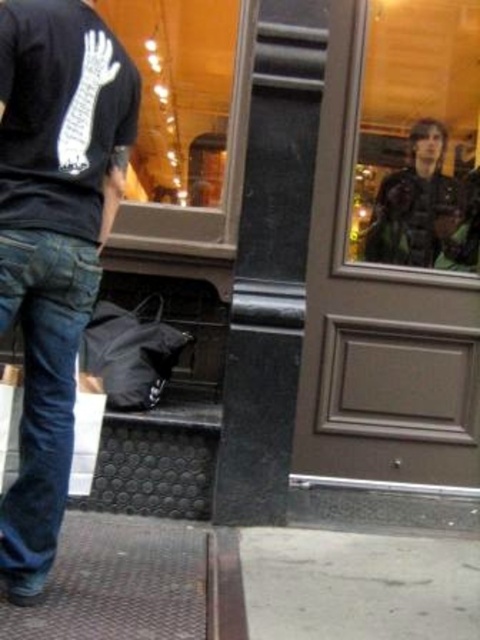
Can you confirm if transparent glass door at upper right is positioned to the right of denim at left?

Indeed, transparent glass door at upper right is positioned on the right side of denim at left.

Can you confirm if transparent glass door at upper right is taller than denim at left?

Indeed, transparent glass door at upper right has a greater height compared to denim at left.

The width and height of the screenshot is (480, 640). What do you see at coordinates (419, 138) in the screenshot? I see `transparent glass door at upper right` at bounding box center [419, 138].

This screenshot has width=480, height=640. I want to click on transparent glass door at upper right, so click(x=419, y=138).

Where is `gray concrete pavement at lower center`? gray concrete pavement at lower center is located at coordinates (359, 586).

What do you see at coordinates (359, 586) in the screenshot?
I see `gray concrete pavement at lower center` at bounding box center [359, 586].

At what (x,y) coordinates should I click in order to perform the action: click on gray concrete pavement at lower center. Please return your answer as a coordinate pair (x, y). The image size is (480, 640). Looking at the image, I should click on (359, 586).

Is point (130, 148) positioned behind point (392, 193)?

No, (130, 148) is closer to viewer.

Can you confirm if black matte jeans at lower left is shorter than dark brown leather jacket at upper right?

No, black matte jeans at lower left is not shorter than dark brown leather jacket at upper right.

At what (x,y) coordinates should I click in order to perform the action: click on black matte jeans at lower left. Please return your answer as a coordinate pair (x, y). The width and height of the screenshot is (480, 640). Looking at the image, I should click on (54, 241).